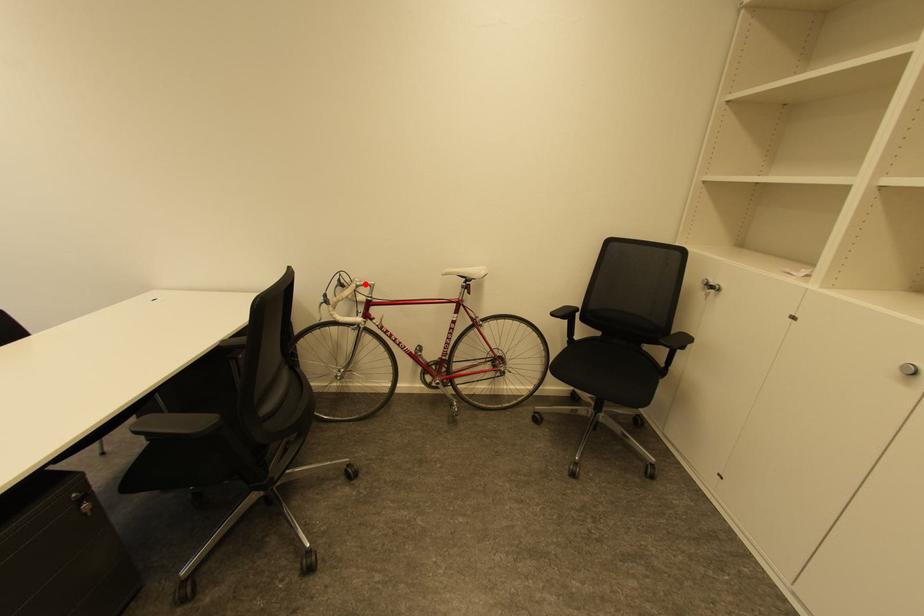
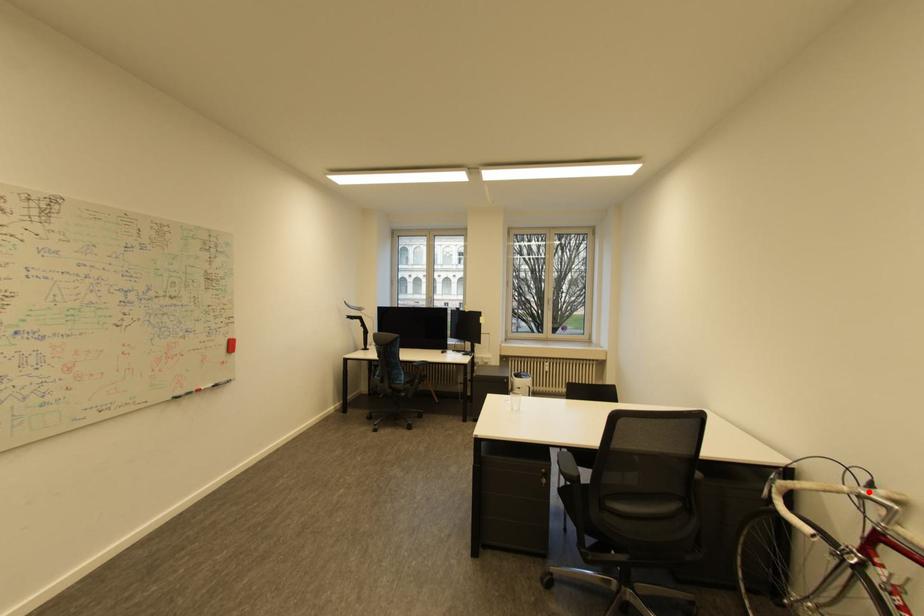
I am providing you with two images of the same scene from different viewpoints. A red point is marked on the first image and another point is marked on the second image. Is the red point in image1 aligned with the point shown in image2?

Yes